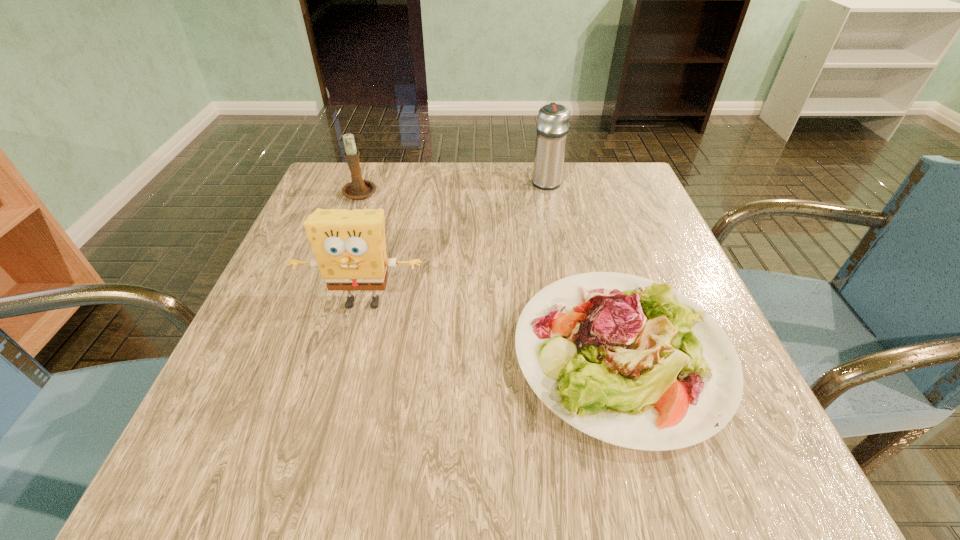
Image resolution: width=960 pixels, height=540 pixels. Identify the location of thermos bottle. (553, 121).

This screenshot has height=540, width=960. I want to click on sponge, so click(349, 245).

The height and width of the screenshot is (540, 960). I want to click on the second shortest object, so click(357, 189).

The width and height of the screenshot is (960, 540). I want to click on the shortest object, so click(x=632, y=362).

Where is `vacant area situated with a handle on the side of the thermos bottle`? vacant area situated with a handle on the side of the thermos bottle is located at coordinates (542, 162).

What are the coordinates of `vacant position located on the face of the sponge` in the screenshot? It's located at (321, 463).

Locate an element on the screen. This screenshot has height=540, width=960. blank space located 0.060m on the side of the third tallest object with the handle is located at coordinates (369, 168).

What are the coordinates of `free spot located on the side of the third tallest object with the handle` in the screenshot? It's located at (369, 168).

At what (x,y) coordinates should I click in order to perform the action: click on free space located on the left of the salad plate. Please return your answer as a coordinate pair (x, y). Looking at the image, I should click on (305, 353).

Find the location of a particular element. The image size is (960, 540). thermos bottle present at the far edge is located at coordinates (553, 121).